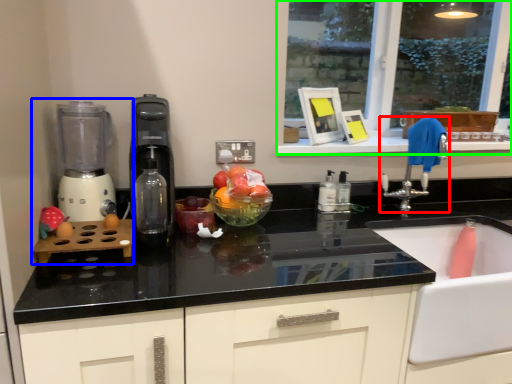
Question: Which is nearer to the tap (highlighted by a red box)? mixer (highlighted by a blue box) or window (highlighted by a green box).

Choices:
 (A) mixer
 (B) window

Answer: (A)